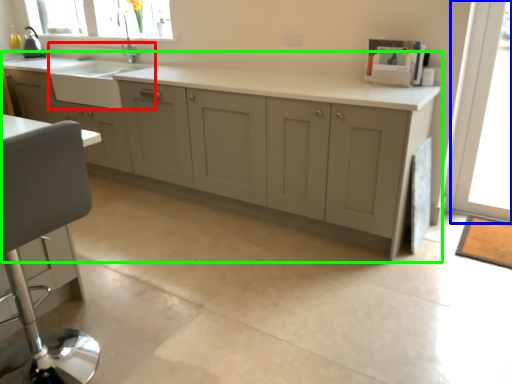
Question: Which object is positioned farthest from sink (highlighted by a red box)? Select from window screen (highlighted by a blue box) and cabinetry (highlighted by a green box).

Choices:
 (A) window screen
 (B) cabinetry

Answer: (A)